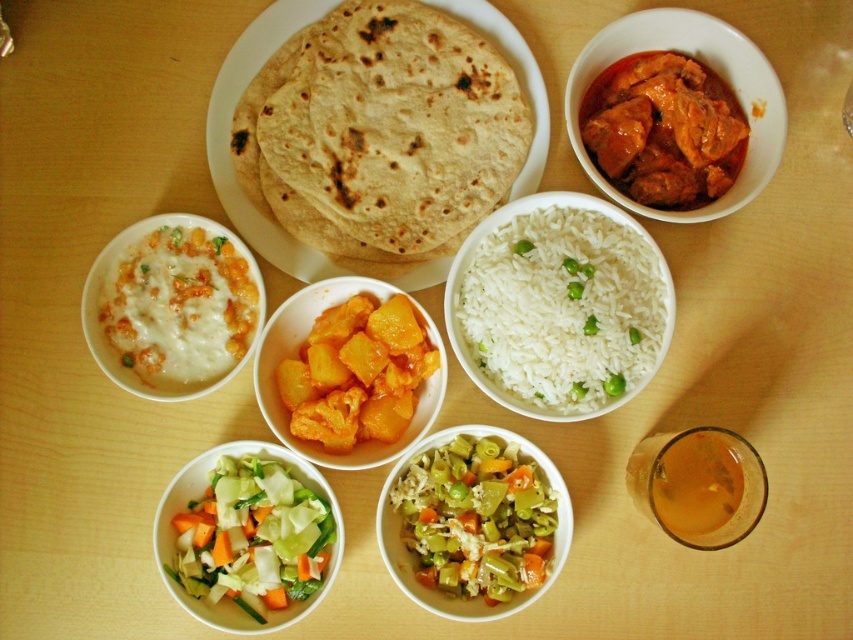
You are a guest at this meal and want to reach for the yellow matte pineapple at center without touching the white polished rice at center. Is there enough space between them for your hand?

The white polished rice at center is wider than the yellow matte pineapple at center, but since the question is about space between them, the description only provides their widths, not the distance between. Therefore, it cannot be determined from the given information.

You are a guest at this meal and want to reach the golden brown dough at center without moving the white polished rice at center. How can you do this?

The white polished rice at center is in front of the golden brown dough at center, so you can reach around the sides of the white polished rice at center to access the golden brown dough at center without moving it.